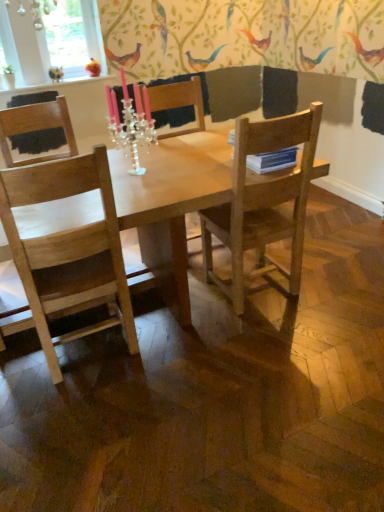
Question: Does wooden chair at center have a larger size compared to matte orange bird at upper left, placed as the 2th bird when sorted from left to right?

Choices:
 (A) no
 (B) yes

Answer: (B)

Question: Could matte orange bird at upper left, arranged as the first bird when viewed from the right, be considered to be inside wooden chair at center?

Choices:
 (A) no
 (B) yes

Answer: (A)

Question: Can you confirm if wooden chair at center is taller than matte orange bird at upper left, placed as the 2th bird when sorted from left to right?

Choices:
 (A) no
 (B) yes

Answer: (B)

Question: Is wooden chair at center shorter than matte orange bird at upper left, arranged as the first bird when viewed from the right?

Choices:
 (A) no
 (B) yes

Answer: (A)

Question: Does wooden chair at center have a greater width compared to matte orange bird at upper left, placed as the 2th bird when sorted from left to right?

Choices:
 (A) yes
 (B) no

Answer: (A)

Question: From a real-world perspective, is light brown wooden table at center positioned above or below wooden chair at center?

Choices:
 (A) below
 (B) above

Answer: (A)

Question: Would you say light brown wooden table at center is inside or outside wooden chair at center?

Choices:
 (A) inside
 (B) outside

Answer: (B)

Question: Based on their positions, is light brown wooden table at center located to the left or right of wooden chair at center?

Choices:
 (A) right
 (B) left

Answer: (B)

Question: From their relative heights in the image, would you say light brown wooden table at center is taller or shorter than wooden chair at center?

Choices:
 (A) short
 (B) tall

Answer: (A)

Question: Which is correct: wooden chair at left, marked as the second chair in a right-to-left arrangement, is inside wooden chair at right, the 1th chair when ordered from right to left, or outside of it?

Choices:
 (A) inside
 (B) outside

Answer: (B)

Question: Considering the positions of wooden chair at left, the 1th chair positioned from the left, and wooden chair at right, the 1th chair when ordered from right to left, in the image, is wooden chair at left, the 1th chair positioned from the left, bigger or smaller than wooden chair at right, the 1th chair when ordered from right to left,?

Choices:
 (A) small
 (B) big

Answer: (A)

Question: In terms of height, does wooden chair at left, the 1th chair positioned from the left, look taller or shorter compared to wooden chair at right, marked as the 2th chair in a left-to-right arrangement?

Choices:
 (A) tall
 (B) short

Answer: (B)

Question: From a real-world perspective, is wooden chair at left, the 1th chair positioned from the left, above or below wooden chair at right, marked as the 2th chair in a left-to-right arrangement?

Choices:
 (A) above
 (B) below

Answer: (A)

Question: Considering the positions of wooden chair at right, the 1th chair when ordered from right to left, and crystal clear candle holder at center in the image, is wooden chair at right, the 1th chair when ordered from right to left, wider or thinner than crystal clear candle holder at center?

Choices:
 (A) wide
 (B) thin

Answer: (A)

Question: Choose the correct answer: Is wooden chair at right, the 1th chair when ordered from right to left, inside crystal clear candle holder at center or outside it?

Choices:
 (A) inside
 (B) outside

Answer: (B)